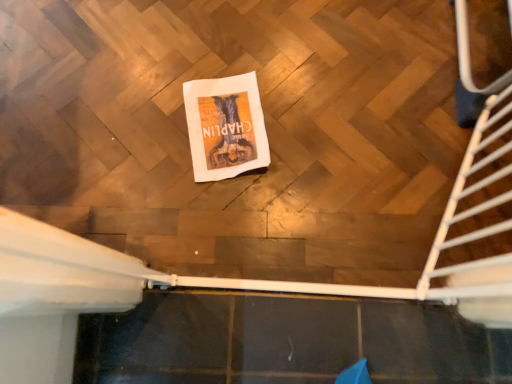
Find the location of a particular element. This screenshot has width=512, height=384. unoccupied area behind white metal stairs at right is located at coordinates (421, 65).